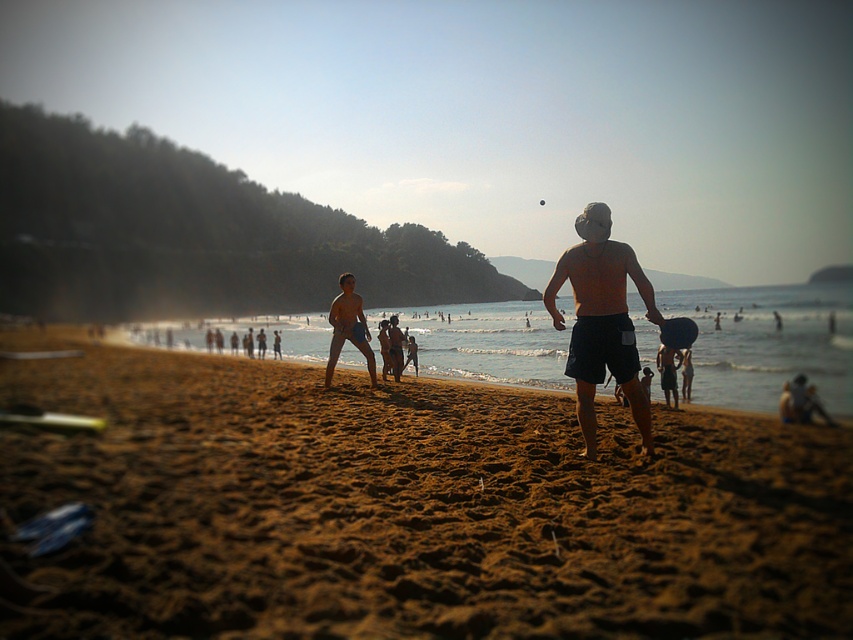
You are standing on the beach and want to pick up two items marked by points. The first item is at point (598, 528) and the second is at point (335, 333). Which item will you reach first if you move towards them in the direction they are located?

You will reach the item at point (598, 528) first because it is closer to you than the item at point (335, 333).

You are standing at the point with coordinates point [631,401] and want to walk towards the water. There is an obstacle at point [595,545]. Will you have to go around it?

Since point [595,545] is in front of point [631,401], the obstacle at point [595,545] is blocking your path towards the water. You will need to go around it.